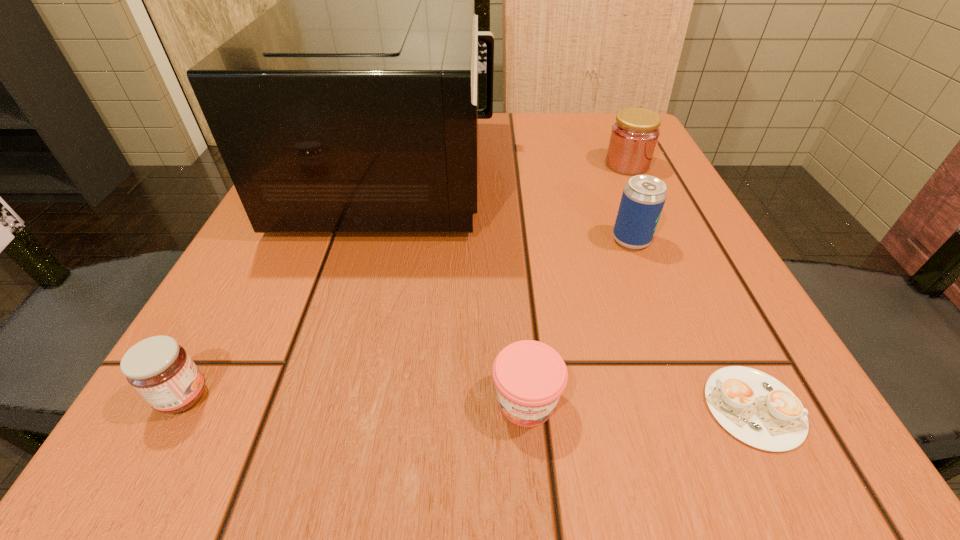
In the image, there is a desktop. Where is `vacant space at the far right corner`? The image size is (960, 540). vacant space at the far right corner is located at coordinates (584, 113).

Where is `vacant area that lies between the microwave_oven and the cappuccino`? vacant area that lies between the microwave_oven and the cappuccino is located at coordinates (575, 289).

The height and width of the screenshot is (540, 960). What are the coordinates of `free space between the microwave_oven and the shortest object` in the screenshot? It's located at (575, 289).

Image resolution: width=960 pixels, height=540 pixels. Identify the location of free space between the beer can and the fourth tallest object. (407, 318).

Image resolution: width=960 pixels, height=540 pixels. What are the coordinates of `free point between the second jam from right to left and the beer can` in the screenshot? It's located at (579, 321).

Image resolution: width=960 pixels, height=540 pixels. What are the coordinates of `free point between the shortest object and the fourth tallest object` in the screenshot? It's located at (468, 402).

Locate an element on the screen. free space between the shortest object and the leftmost jam is located at coordinates (468, 402).

The width and height of the screenshot is (960, 540). Identify the location of free space that is in between the shortest object and the beer can. (692, 323).

At what (x,y) coordinates should I click in order to perform the action: click on empty space that is in between the cappuccino and the beer can. Please return your answer as a coordinate pair (x, y). This screenshot has height=540, width=960. Looking at the image, I should click on click(692, 323).

Identify the location of unoccupied position between the leftmost jam and the second jam from right to left. click(355, 399).